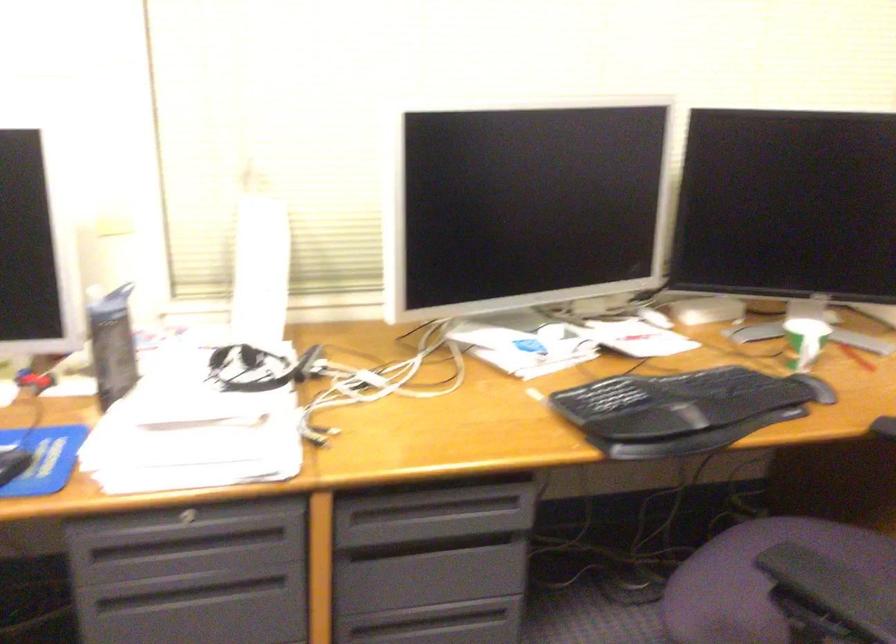
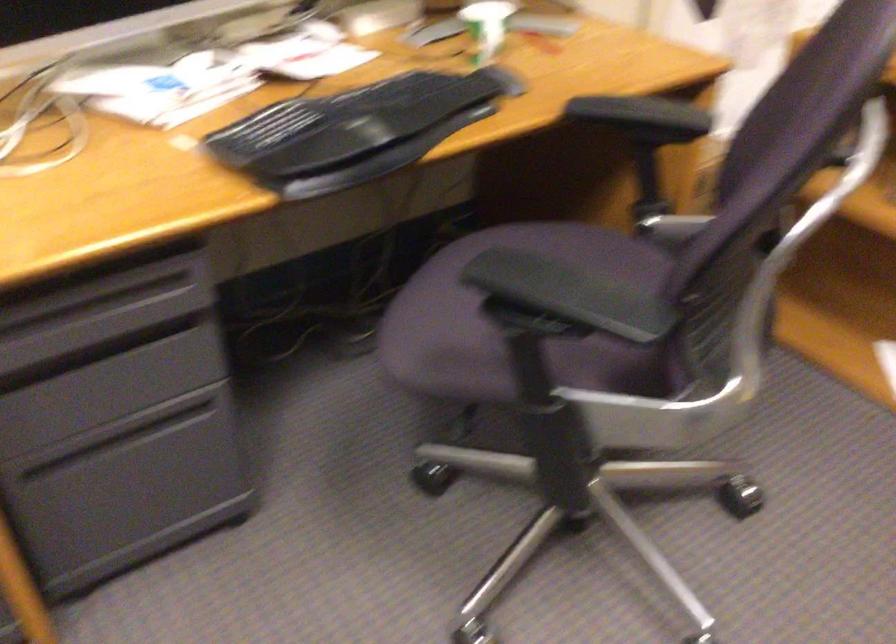
From the picture: The first image is from the beginning of the video and the second image is from the end. How did the camera likely rotate when shooting the video?

The camera rotated toward right-down.